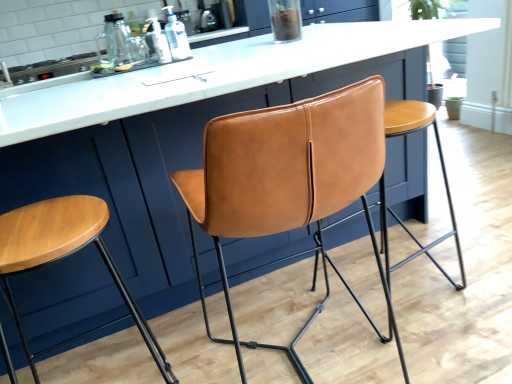
Question: Considering the relative positions of clear plastic bottle at center, the second bottle when ordered from left to right, and metallic stove top at upper left in the image provided, is clear plastic bottle at center, the second bottle when ordered from left to right, behind metallic stove top at upper left?

Choices:
 (A) no
 (B) yes

Answer: (A)

Question: Is clear plastic bottle at center, which is the first bottle from right to left, looking in the opposite direction of metallic stove top at upper left?

Choices:
 (A) yes
 (B) no

Answer: (B)

Question: Could you tell me if clear plastic bottle at center, the second bottle when ordered from left to right, is facing metallic stove top at upper left?

Choices:
 (A) no
 (B) yes

Answer: (A)

Question: Is clear plastic bottle at center, the second bottle when ordered from left to right, not inside metallic stove top at upper left?

Choices:
 (A) no
 (B) yes

Answer: (B)

Question: Can you confirm if clear plastic bottle at center, which is the first bottle from right to left, is positioned to the left of metallic stove top at upper left?

Choices:
 (A) yes
 (B) no

Answer: (B)

Question: From a real-world perspective, is clear plastic bottle at center, the second bottle when ordered from left to right, located beneath metallic stove top at upper left?

Choices:
 (A) yes
 (B) no

Answer: (B)

Question: From a real-world perspective, does metallic stove top at upper left stand above clear plastic bottle at center, the second bottle when ordered from left to right?

Choices:
 (A) no
 (B) yes

Answer: (A)

Question: Is metallic stove top at upper left far from clear plastic bottle at center, which is the first bottle from right to left?

Choices:
 (A) no
 (B) yes

Answer: (B)

Question: Does metallic stove top at upper left touch clear plastic bottle at center, the second bottle when ordered from left to right?

Choices:
 (A) no
 (B) yes

Answer: (A)

Question: Would you say metallic stove top at upper left is outside clear plastic bottle at center, the second bottle when ordered from left to right?

Choices:
 (A) yes
 (B) no

Answer: (A)

Question: From the image's perspective, is metallic stove top at upper left on top of clear plastic bottle at center, the second bottle when ordered from left to right?

Choices:
 (A) yes
 (B) no

Answer: (A)

Question: Does metallic stove top at upper left have a lesser width compared to clear plastic bottle at center, which is the first bottle from right to left?

Choices:
 (A) yes
 (B) no

Answer: (B)

Question: From the image's perspective, is translucent plastic bottle at upper center, marked as the second bottle in a right-to-left arrangement, under matte leather stool at center, the 2th stool in the left-to-right sequence?

Choices:
 (A) no
 (B) yes

Answer: (A)